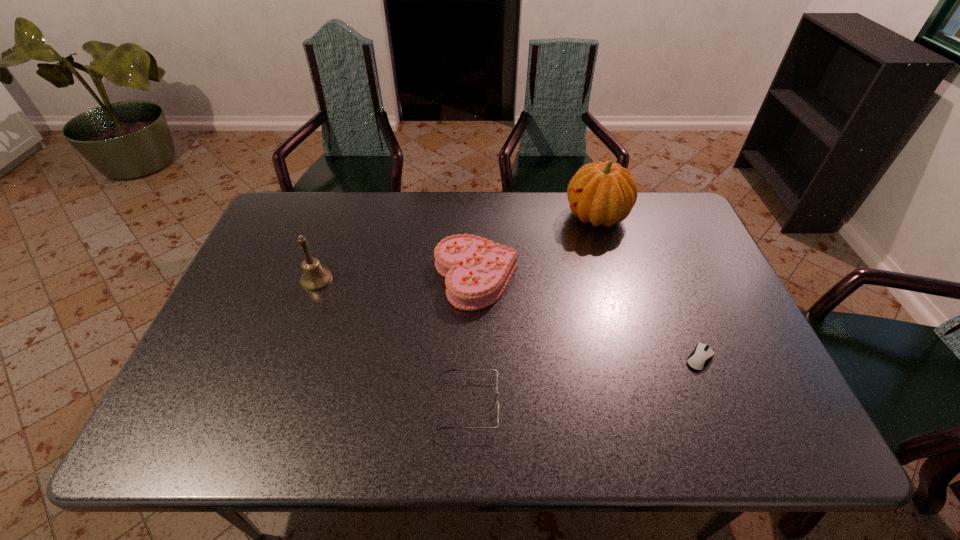
This screenshot has width=960, height=540. I want to click on pumpkin, so click(602, 193).

Locate an element on the screen. This screenshot has width=960, height=540. the farthest object is located at coordinates tap(602, 193).

This screenshot has height=540, width=960. Find the location of `bell`. bell is located at coordinates click(x=314, y=277).

Locate an element on the screen. the fourth shortest object is located at coordinates (314, 277).

Locate an element on the screen. the third tallest object is located at coordinates (477, 271).

You are a GUI agent. You are given a task and a screenshot of the screen. Output one action in this format:
    pyautogui.click(x=<x>, y=<y>)
    Task: Click on the nearest object
    This screenshot has width=960, height=540.
    Given the screenshot: What is the action you would take?
    pyautogui.click(x=448, y=370)

You are a GUI agent. You are given a task and a screenshot of the screen. Output one action in this format:
    pyautogui.click(x=<x>, y=<y>)
    Task: Click on the spectacles
    This screenshot has width=960, height=540.
    Given the screenshot: What is the action you would take?
    pyautogui.click(x=448, y=370)

Image resolution: width=960 pixels, height=540 pixels. What are the coordinates of `mouse` in the screenshot? It's located at (701, 356).

I want to click on the shortest object, so click(701, 356).

Locate an element on the screen. The width and height of the screenshot is (960, 540). free space located on the carved face of the pumpkin is located at coordinates (476, 216).